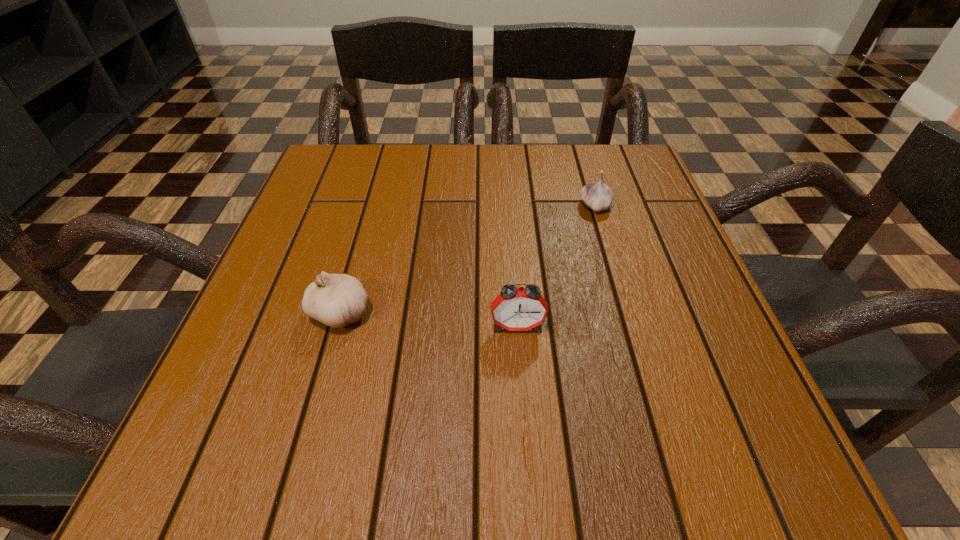
This screenshot has width=960, height=540. Identify the location of vacant region between the left garlic and the farther garlic. (468, 259).

The width and height of the screenshot is (960, 540). I want to click on unoccupied position between the farthest object and the second object from left to right, so click(556, 266).

At what (x,y) coordinates should I click in order to perform the action: click on empty space between the farther garlic and the second object from left to right. Please return your answer as a coordinate pair (x, y). Looking at the image, I should click on (556, 266).

The image size is (960, 540). I want to click on vacant space that's between the second object from left to right and the leftmost object, so click(429, 319).

Identify the location of unoccupied position between the second object from right to left and the left garlic. (429, 319).

Identify the location of vacant area that lies between the alarm clock and the leftmost object. This screenshot has width=960, height=540. click(x=429, y=319).

You are a GUI agent. You are given a task and a screenshot of the screen. Output one action in this format:
    pyautogui.click(x=<x>, y=<y>)
    Task: Click on the free point between the right garlic and the second object from left to right
    The width and height of the screenshot is (960, 540).
    Given the screenshot: What is the action you would take?
    pyautogui.click(x=556, y=266)

This screenshot has width=960, height=540. Find the location of `free space between the second object from left to right and the rightmost object`. free space between the second object from left to right and the rightmost object is located at coordinates (556, 266).

You are a GUI agent. You are given a task and a screenshot of the screen. Output one action in this format:
    pyautogui.click(x=<x>, y=<y>)
    Task: Click on the object that is the closest to the rightmost object
    This screenshot has height=540, width=960.
    Given the screenshot: What is the action you would take?
    pyautogui.click(x=515, y=309)

Locate an element on the screen. object identified as the second closest to the nearer garlic is located at coordinates (598, 196).